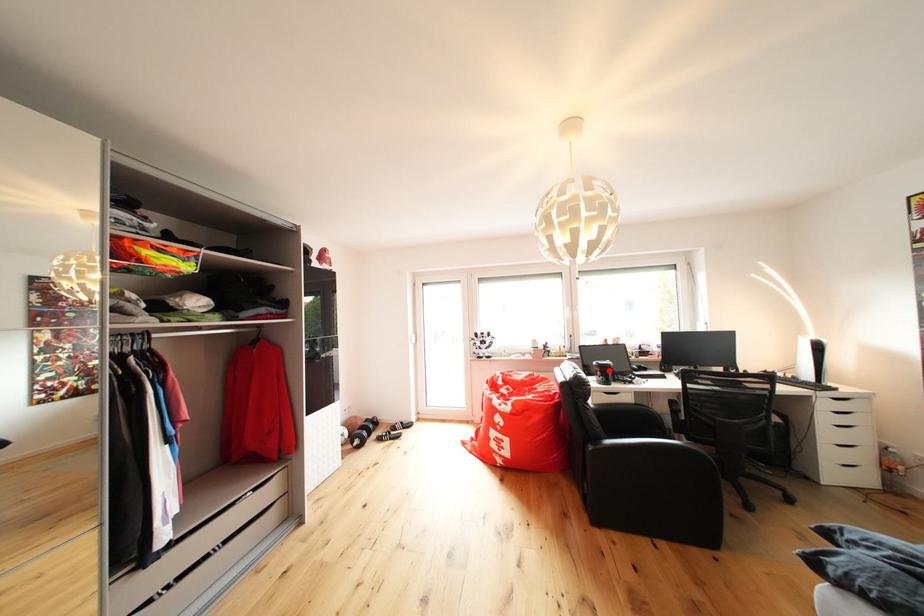
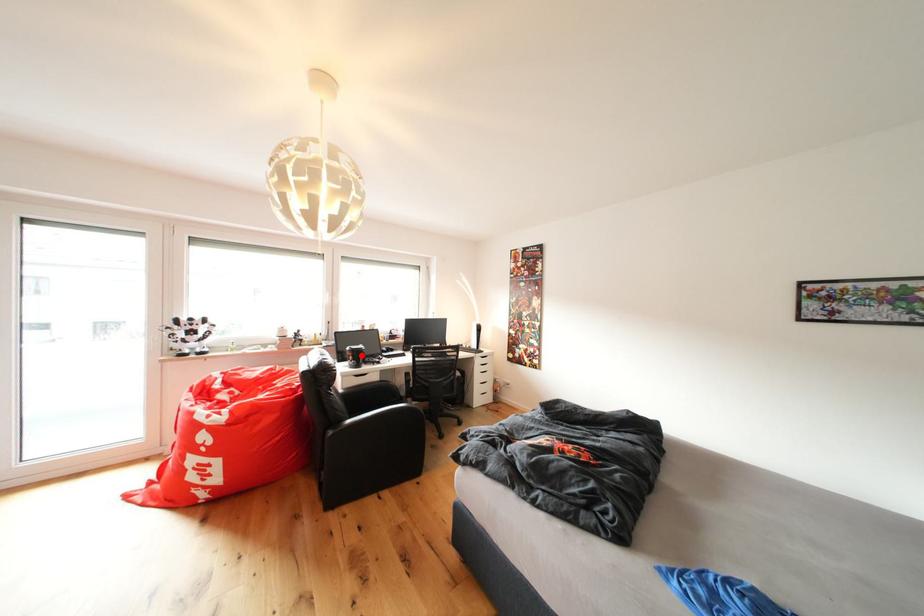
Based on the photo, I am providing you with two images of the same scene from different viewpoints. A red point is marked on the first image and another point is marked on the second image. Are the points marked in image1 and image2 representing the same 3D position?

Yes